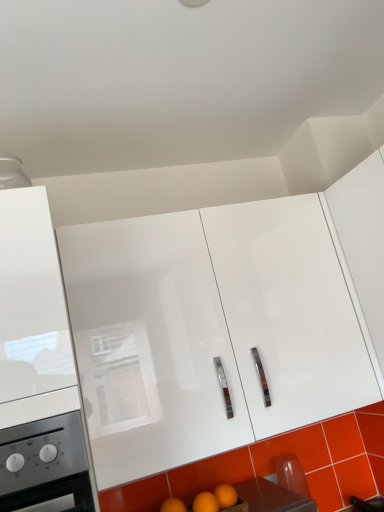
Question: Which direction should I rotate to face white glossy cabinet at center, which is the second cabinetry in left-to-right order, — up or down?

Choices:
 (A) up
 (B) down

Answer: (B)

Question: Can you confirm if orange glossy tile at lower right is smaller than orange matte wood at lower center?

Choices:
 (A) yes
 (B) no

Answer: (A)

Question: Is orange glossy tile at lower right at the left side of orange matte wood at lower center?

Choices:
 (A) yes
 (B) no

Answer: (B)

Question: From the image's perspective, is orange glossy tile at lower right under orange matte wood at lower center?

Choices:
 (A) yes
 (B) no

Answer: (A)

Question: Considering the relative positions of orange glossy tile at lower right and orange matte wood at lower center in the image provided, is orange glossy tile at lower right in front of orange matte wood at lower center?

Choices:
 (A) yes
 (B) no

Answer: (B)

Question: Can you confirm if orange glossy tile at lower right is shorter than orange matte wood at lower center?

Choices:
 (A) no
 (B) yes

Answer: (A)

Question: Can you confirm if orange glossy tile at lower right is bigger than orange matte wood at lower center?

Choices:
 (A) yes
 (B) no

Answer: (B)

Question: From the image's perspective, is white glossy cabinet at left, the 1th cabinetry positioned from the left, under orange matte wood at lower center?

Choices:
 (A) no
 (B) yes

Answer: (A)

Question: Is white glossy cabinet at left, the 3th cabinetry positioned from the right, at the left side of orange matte wood at lower center?

Choices:
 (A) yes
 (B) no

Answer: (A)

Question: Can you confirm if white glossy cabinet at left, the 3th cabinetry positioned from the right, is smaller than orange matte wood at lower center?

Choices:
 (A) no
 (B) yes

Answer: (A)

Question: Does white glossy cabinet at left, the 3th cabinetry positioned from the right, have a lesser height compared to orange matte wood at lower center?

Choices:
 (A) yes
 (B) no

Answer: (B)

Question: From a real-world perspective, is white glossy cabinet at left, the 3th cabinetry positioned from the right, located higher than orange matte wood at lower center?

Choices:
 (A) yes
 (B) no

Answer: (A)

Question: Is white glossy cabinet at left, the 1th cabinetry positioned from the left, facing away from orange matte wood at lower center?

Choices:
 (A) no
 (B) yes

Answer: (A)

Question: Is white glossy cabinet at center, which is the second cabinetry in left-to-right order, outside of white glossy cabinet at left, the 1th cabinetry positioned from the left?

Choices:
 (A) yes
 (B) no

Answer: (A)